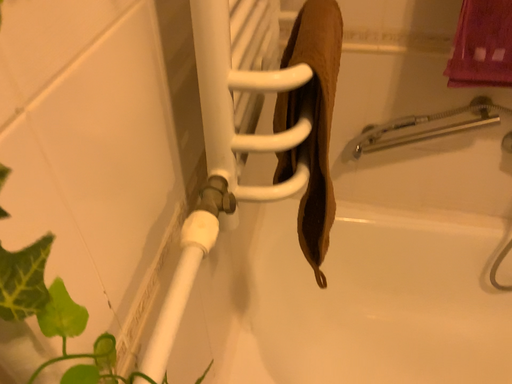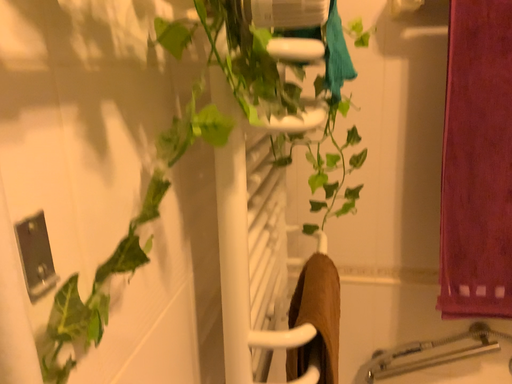
Question: How did the camera likely rotate when shooting the video?

Choices:
 (A) rotated downward
 (B) rotated upward

Answer: (B)